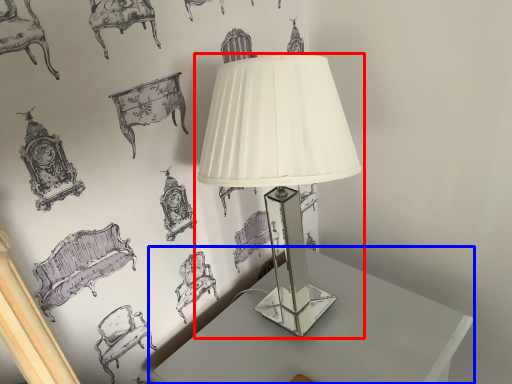
Question: Which point is closer to the camera, lamp (highlighted by a red box) or table (highlighted by a blue box)?

Choices:
 (A) lamp
 (B) table

Answer: (A)